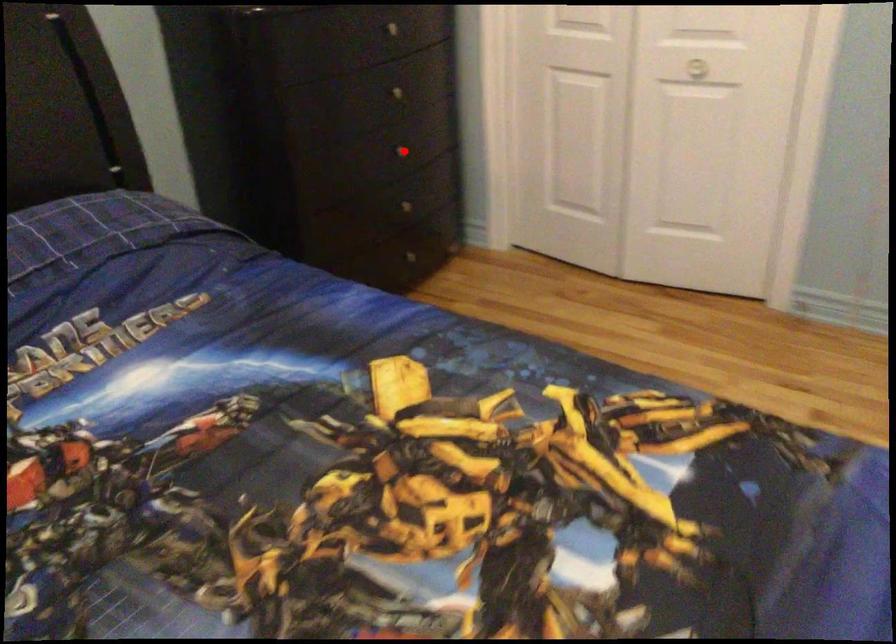
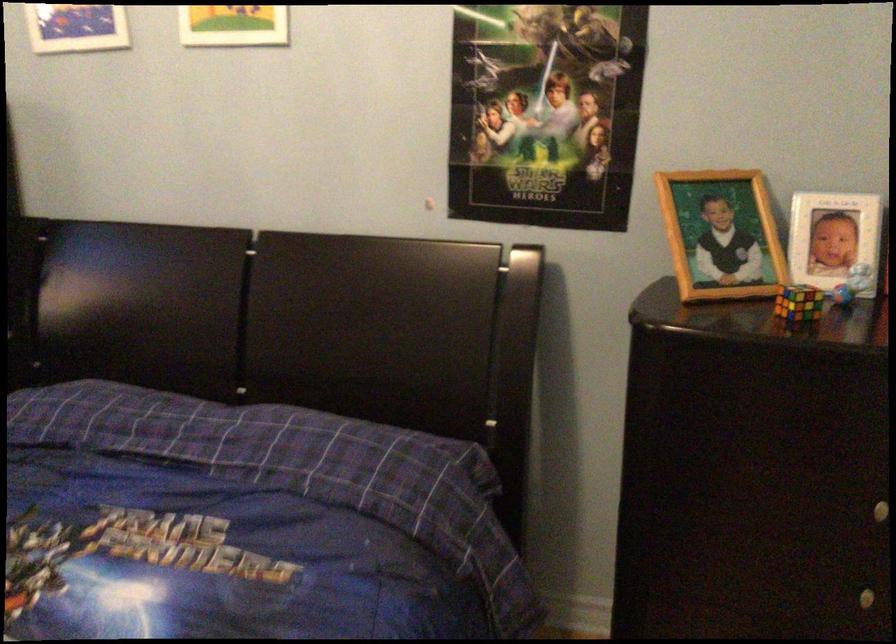
Question: I am providing you with two images of the same scene from different viewpoints. Image1 has a red point marked. In image2, the corresponding 3D location appears at what relative position? Reply with the corresponding letter.

Choices:
 (A) Closer
 (B) Farther

Answer: (A)